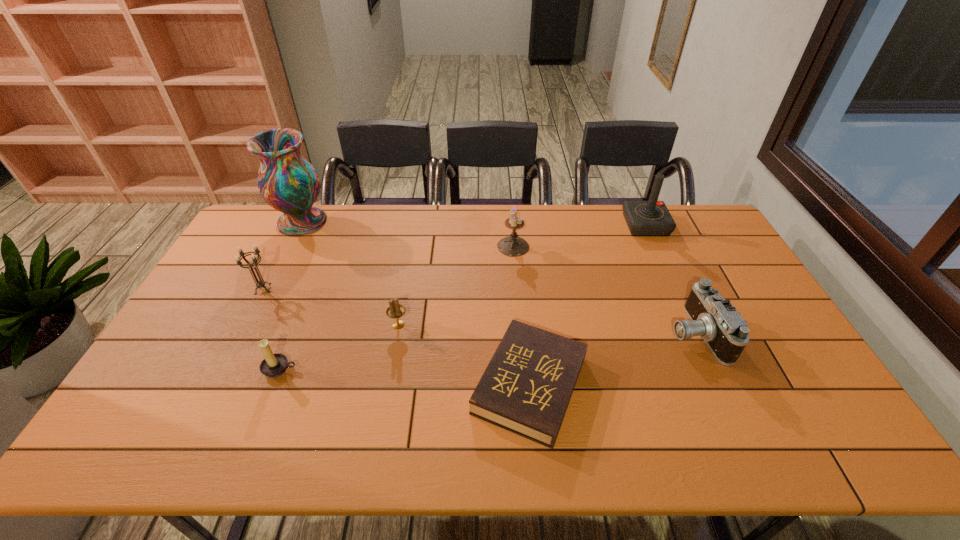
At what (x,y) coordinates should I click in order to perform the action: click on vacant space located on the right of the tallest object. Please return your answer as a coordinate pair (x, y). Looking at the image, I should click on (369, 222).

Identify the location of free location located on the rectangular base of the joystick. (566, 225).

At what (x,y) coordinates should I click in order to perform the action: click on free space located on the rectangular base of the joystick. Please return your answer as a coordinate pair (x, y). Image resolution: width=960 pixels, height=540 pixels. Looking at the image, I should click on (577, 225).

Where is `vacant area situated on the rectangular base of the joystick`? Image resolution: width=960 pixels, height=540 pixels. vacant area situated on the rectangular base of the joystick is located at coordinates (520, 225).

This screenshot has width=960, height=540. Find the location of `free space located 0.340m on the right of the farthest candle holder`. free space located 0.340m on the right of the farthest candle holder is located at coordinates (626, 246).

This screenshot has width=960, height=540. Identify the location of vacant region located 0.070m on the front of the leftmost candle holder. (251, 314).

The image size is (960, 540). In order to click on vacant region located 0.290m on the left of the third candle holder from left to right in this screenshot , I will do `click(289, 325)`.

Find the location of a particular element. The image size is (960, 540). vacant space located 0.360m at the lens of the camera is located at coordinates (542, 333).

Locate an element on the screen. The image size is (960, 540). vacant area located 0.210m at the lens of the camera is located at coordinates (595, 333).

Where is `vacant area situated at the lens of the camera`? This screenshot has width=960, height=540. vacant area situated at the lens of the camera is located at coordinates (598, 333).